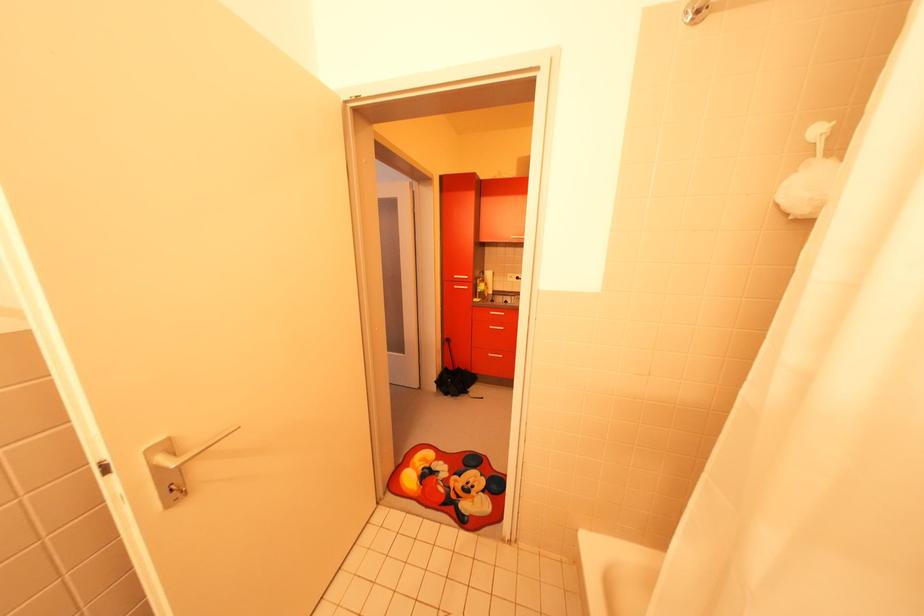
Locate an element on the screen. The image size is (924, 616). silver door handle is located at coordinates (190, 451).